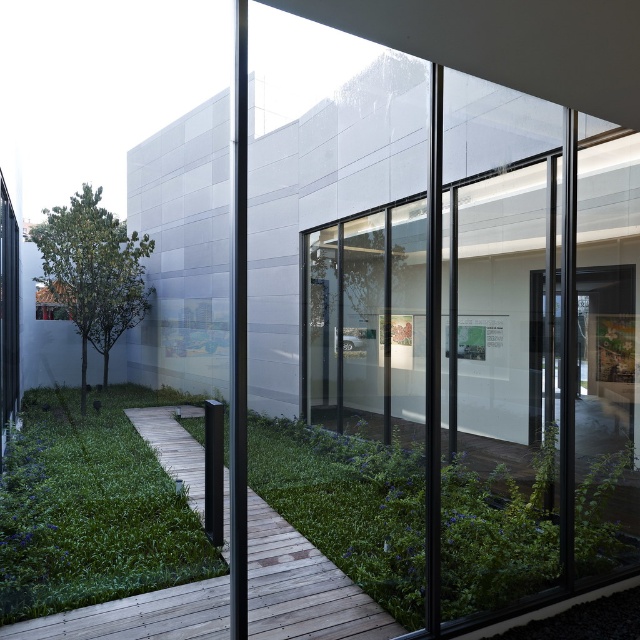
Which is above, green grass at lower left or wooden planks at center?

green grass at lower left is above.

Which is in front, point (38, 404) or point (342, 604)?

Point (342, 604) is more forward.

The width and height of the screenshot is (640, 640). In order to click on green grass at lower left in this screenshot , I will do (92, 508).